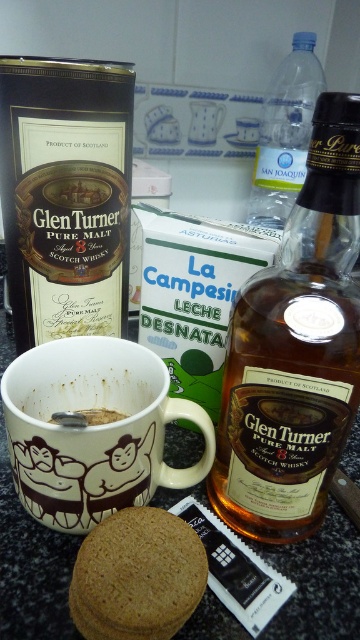
Question: Which of the following is the farthest from the observer?

Choices:
 (A) clear plastic bottle at upper right
 (B) matte black bottle at center
 (C) amber glass bottle at center

Answer: (A)

Question: Is matte black bottle at center thinner than white matte mug at center?

Choices:
 (A) no
 (B) yes

Answer: (B)

Question: Does white matte mug at center have a greater width compared to brown textured biscuit at lower center?

Choices:
 (A) yes
 (B) no

Answer: (A)

Question: Can you confirm if amber glass bottle at center is thinner than matte black bottle at center?

Choices:
 (A) no
 (B) yes

Answer: (B)

Question: Among these objects, which one is nearest to the camera?

Choices:
 (A) amber glass bottle at center
 (B) brown textured biscuit at lower center
 (C) brown matte coffee cup at center
 (D) white matte mug at center

Answer: (A)

Question: Which of these objects is positioned closest to the brown matte coffee cup at center?

Choices:
 (A) amber glass bottle at center
 (B) matte black bottle at center
 (C) clear plastic bottle at upper right

Answer: (A)